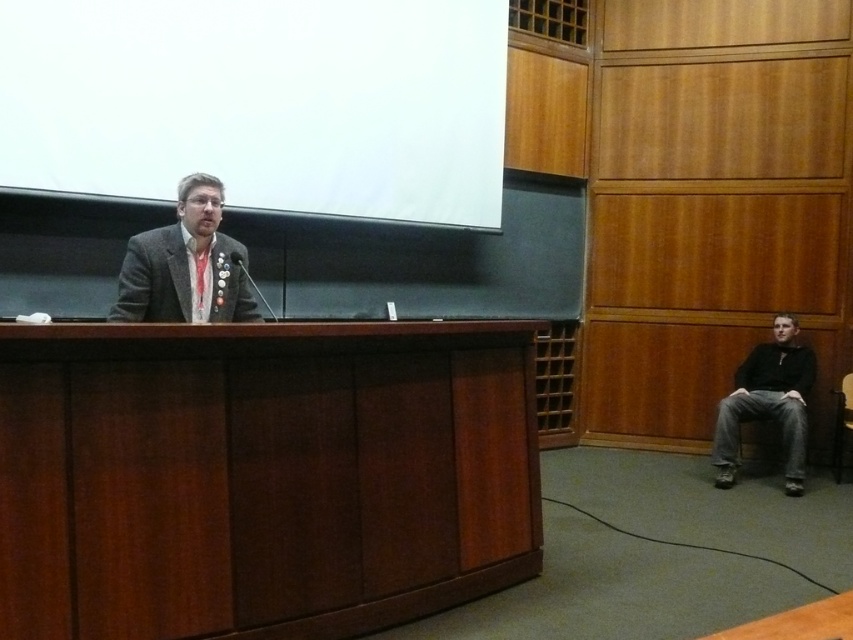
Question: Can you confirm if matte gray suit at center is positioned to the left of black matte jacket at lower right?

Choices:
 (A) yes
 (B) no

Answer: (A)

Question: From the image, what is the correct spatial relationship of matte gray suit at center in relation to wooden chair at right?

Choices:
 (A) left
 (B) right

Answer: (A)

Question: Which point is farther from the camera taking this photo?

Choices:
 (A) (735, 452)
 (B) (842, 406)
 (C) (68, 13)
 (D) (206, 317)

Answer: (B)

Question: Can you confirm if brown wood table at center is positioned to the left of wooden chair at right?

Choices:
 (A) yes
 (B) no

Answer: (A)

Question: Which is nearer to the black matte jacket at lower right?

Choices:
 (A) brown wood table at center
 (B) matte gray suit at center
 (C) white matte projection screen at upper center

Answer: (C)

Question: Which point is closer to the camera taking this photo?

Choices:
 (A) (67, 134)
 (B) (795, 458)

Answer: (A)